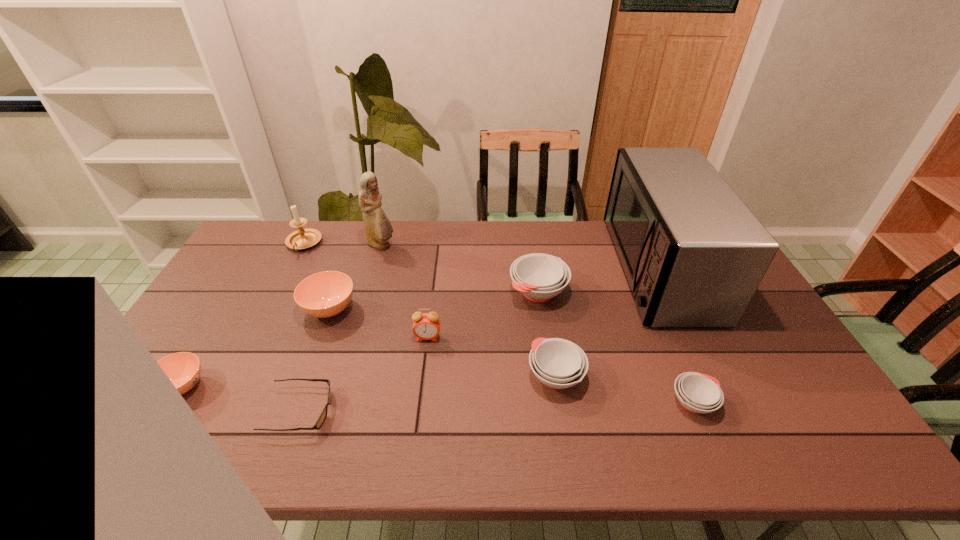
In order to click on object at the near edge in this screenshot , I will do `click(322, 417)`.

Image resolution: width=960 pixels, height=540 pixels. Identify the location of candle holder that is at the left edge. (302, 238).

This screenshot has height=540, width=960. What are the coordinates of `soup bowl present at the left edge` in the screenshot? It's located at (183, 369).

Where is `object positioned at the right edge`? Image resolution: width=960 pixels, height=540 pixels. object positioned at the right edge is located at coordinates (693, 254).

This screenshot has width=960, height=540. In order to click on object that is at the far left corner in this screenshot , I will do `click(302, 238)`.

Find the location of a particular element. The width and height of the screenshot is (960, 540). object present at the far right corner is located at coordinates (693, 254).

This screenshot has height=540, width=960. Identify the location of vacant space at the far edge of the desktop. (440, 221).

At what (x,y) coordinates should I click in order to perform the action: click on free space at the near edge of the desktop. Please return your answer as a coordinate pair (x, y). Looking at the image, I should click on (417, 453).

This screenshot has width=960, height=540. Identify the location of vacant area at the left edge. (254, 284).

The image size is (960, 540). I want to click on free space at the right edge of the desktop, so click(766, 416).